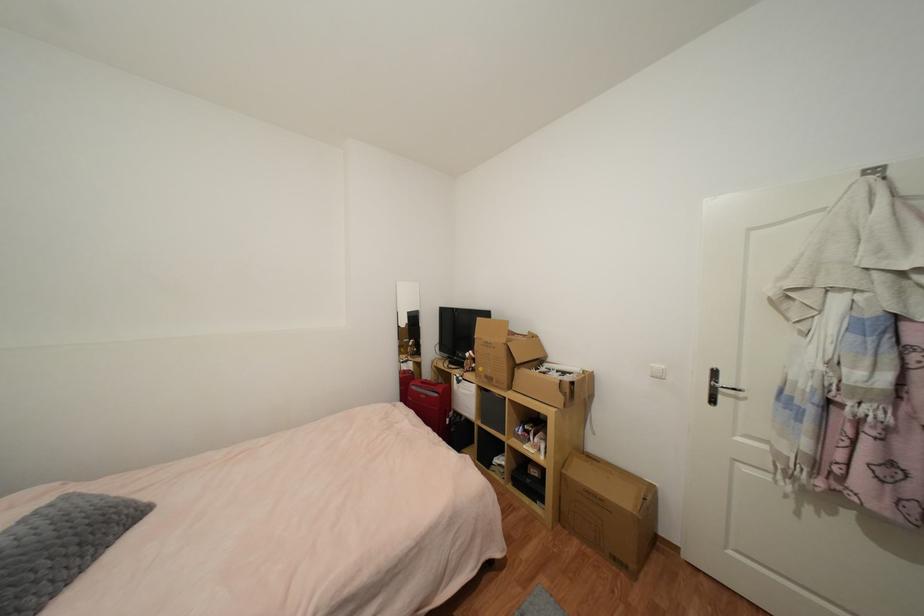
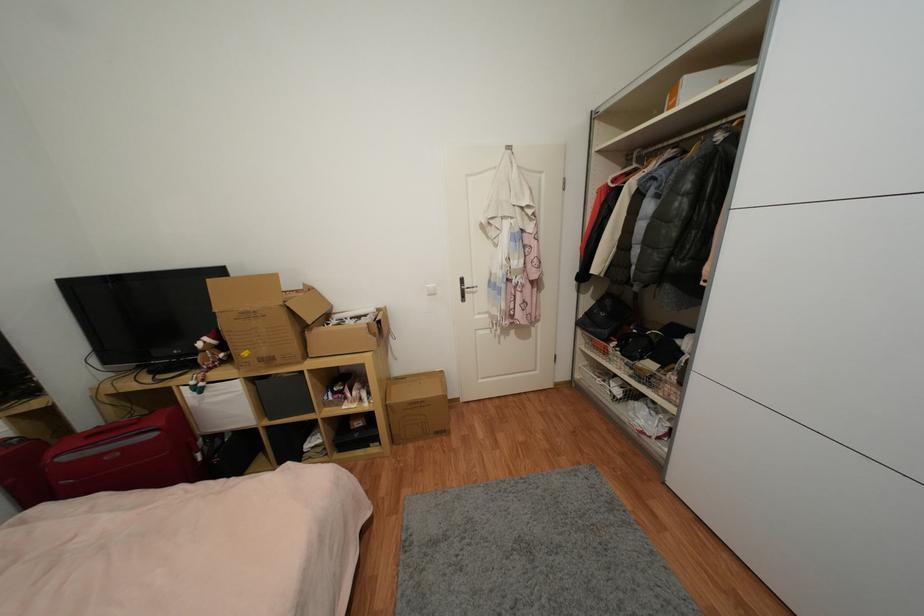
The point at (494, 381) is marked in the first image. Where is the corresponding point in the second image?

(274, 361)